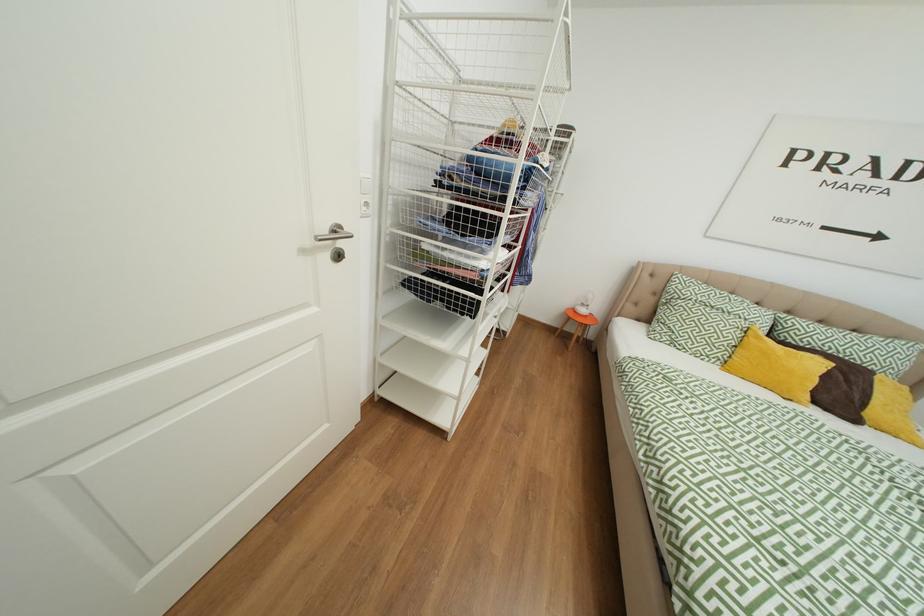
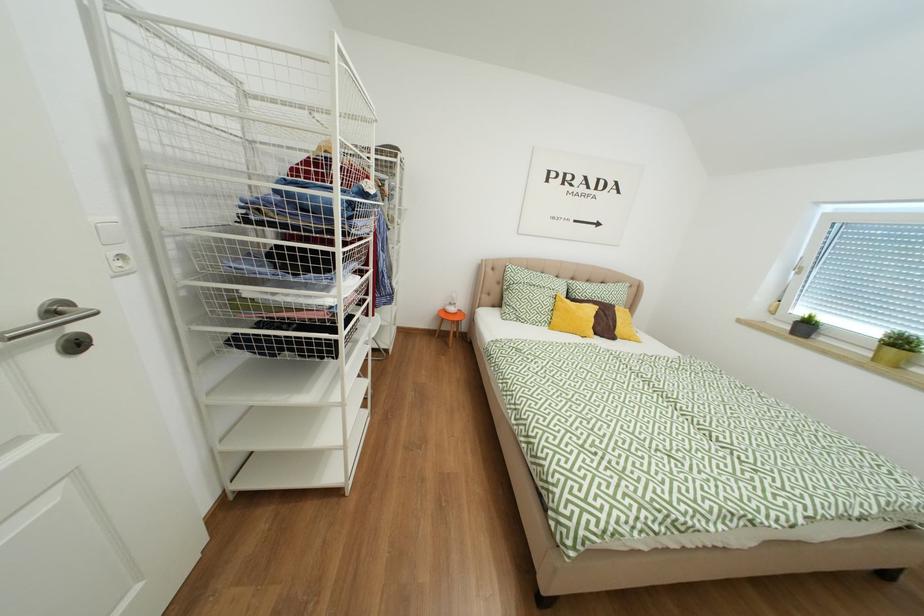
Question: How did the camera likely rotate?

Choices:
 (A) Left
 (B) Right
 (C) Up
 (D) Down

Answer: (B)